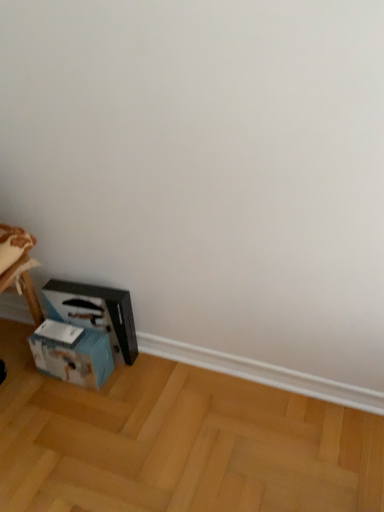
At what (x,y) coordinates should I click in order to perform the action: click on free space to the left of blue cardboard box at lower left. Please return your answer as a coordinate pair (x, y). The image size is (384, 512). Looking at the image, I should click on (25, 379).